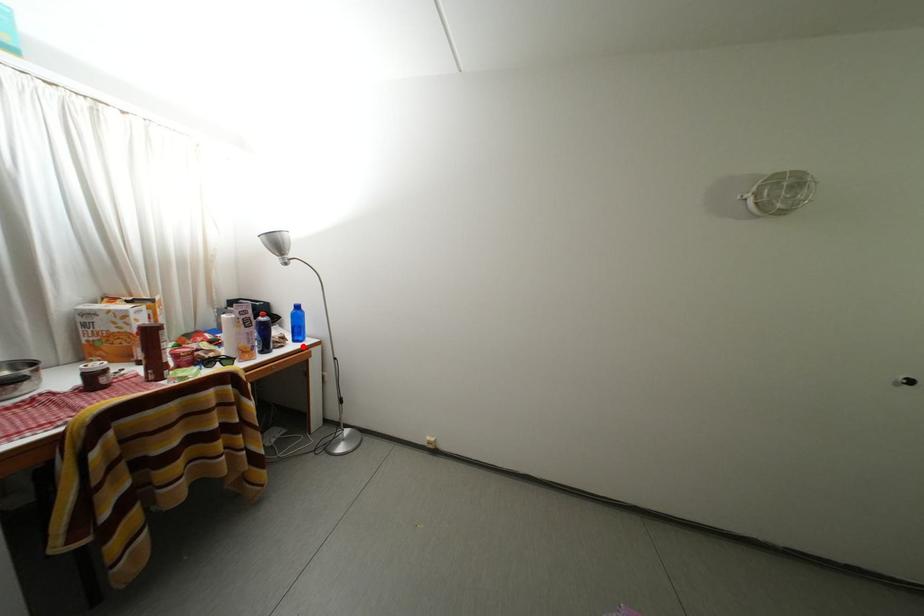
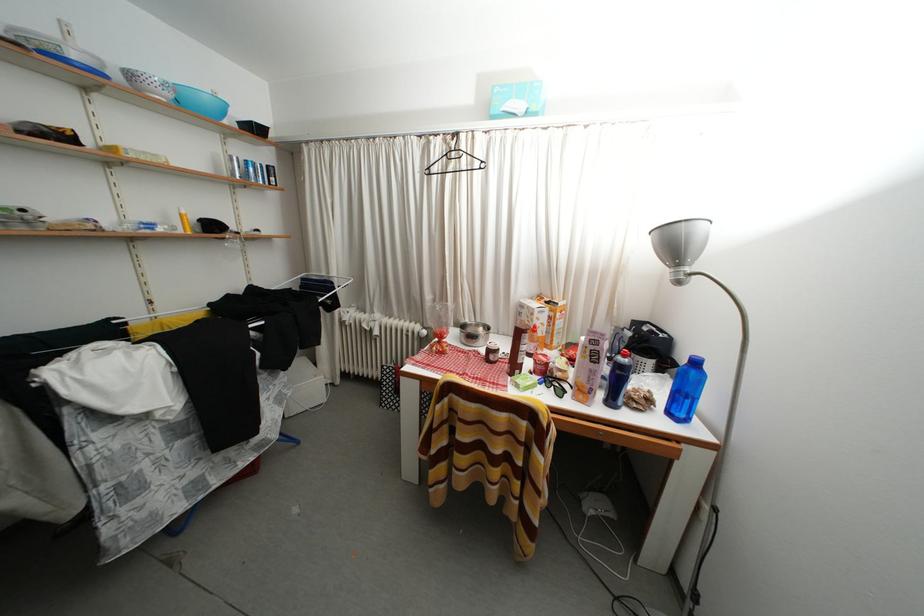
The point at the highlighted location is marked in the first image. Where is the corresponding point in the second image?

(676, 419)